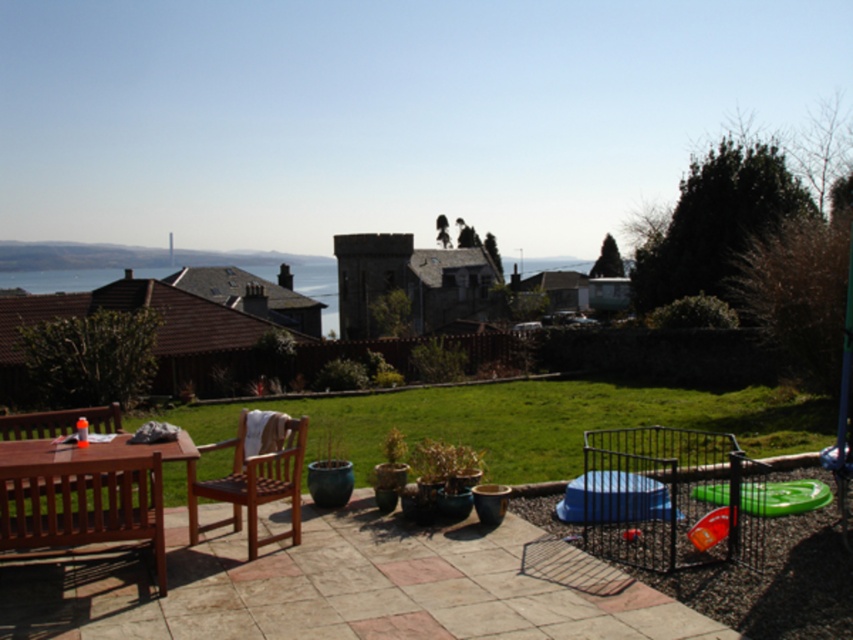
Question: Is wooden table at lower left below wooden chair at center?

Choices:
 (A) no
 (B) yes

Answer: (A)

Question: Can you confirm if wooden table at lower left is thinner than wooden chair at center?

Choices:
 (A) no
 (B) yes

Answer: (A)

Question: Which point is closer to the camera?

Choices:
 (A) (242, 451)
 (B) (161, 496)

Answer: (B)

Question: Can you confirm if wooden table at lower left is positioned to the left of wooden chair at center?

Choices:
 (A) no
 (B) yes

Answer: (B)

Question: Among these points, which one is farthest from the camera?

Choices:
 (A) (160, 538)
 (B) (238, 426)

Answer: (B)

Question: Which point is closer to the camera taking this photo?

Choices:
 (A) (245, 426)
 (B) (55, 480)

Answer: (B)